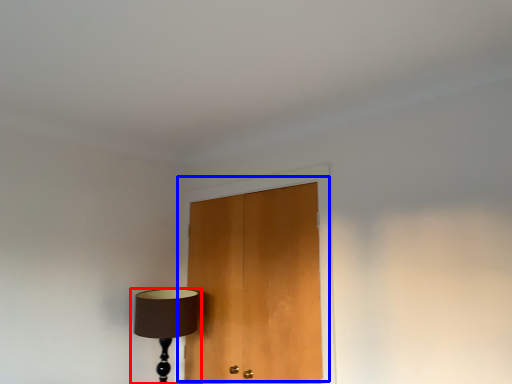
Question: Which point is further to the camera, lamp (highlighted by a red box) or door (highlighted by a blue box)?

Choices:
 (A) lamp
 (B) door

Answer: (A)